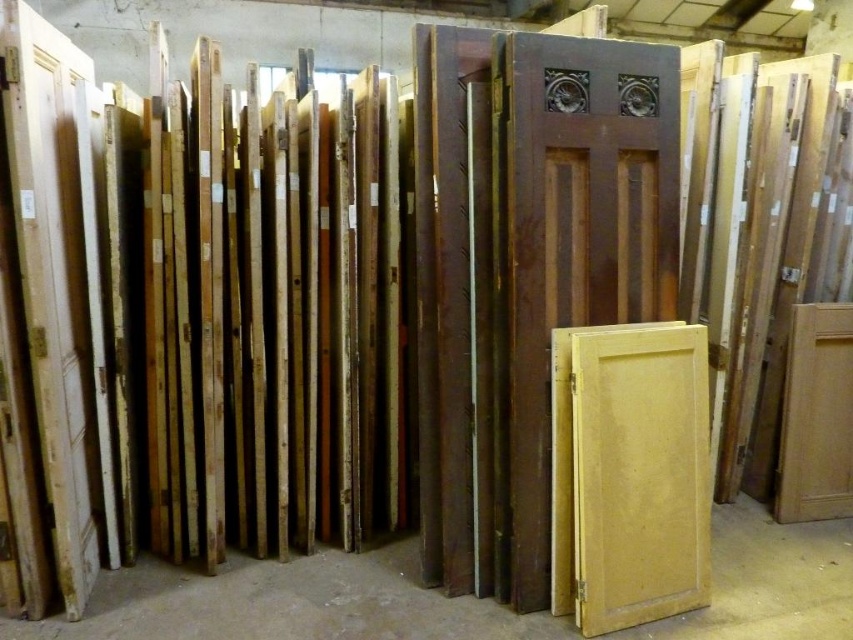
Does matte brown wooden door at center have a greater width compared to light yellow wood door at center?

Yes.

Is matte brown wooden door at center thinner than light yellow wood door at center?

In fact, matte brown wooden door at center might be wider than light yellow wood door at center.

Does point (527, 141) come closer to viewer compared to point (579, 422)?

Yes.

Find the location of `matte brown wooden door at center`. matte brown wooden door at center is located at coordinates (573, 241).